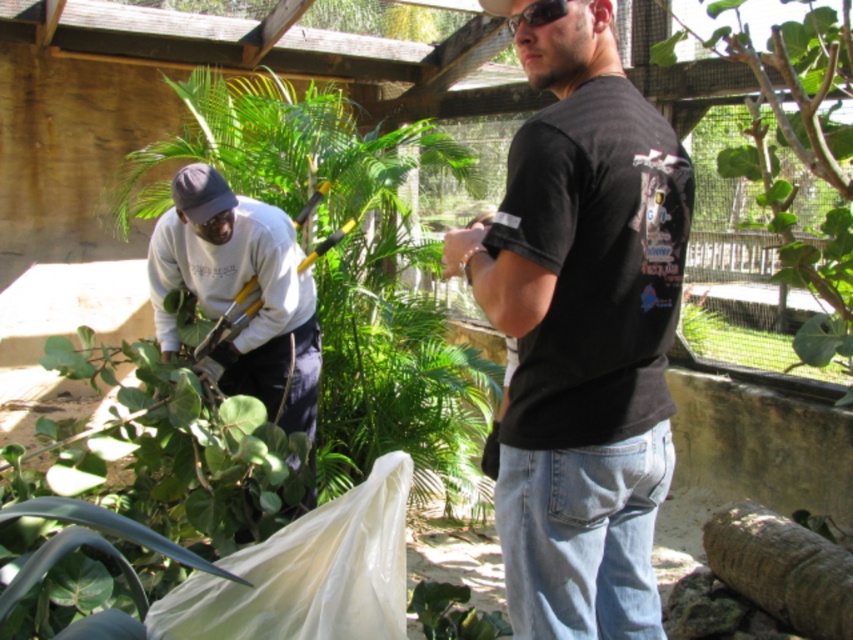
Based on the scene description, which green leafy plant is bigger between the green leafy plant at left and the green leafy plant at center?

The green leafy plant at left is larger in size than the green leafy plant at center.